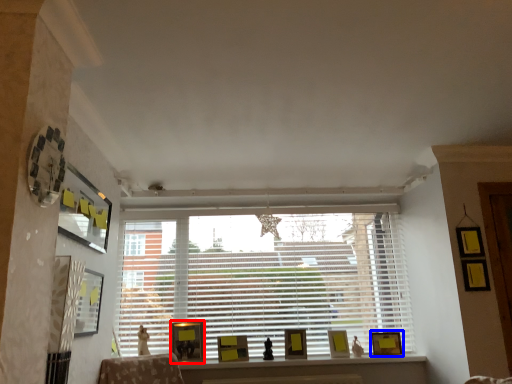
Question: Which object appears closest to the camera in this image, picture frame (highlighted by a red box) or picture frame (highlighted by a blue box)?

Choices:
 (A) picture frame
 (B) picture frame

Answer: (A)